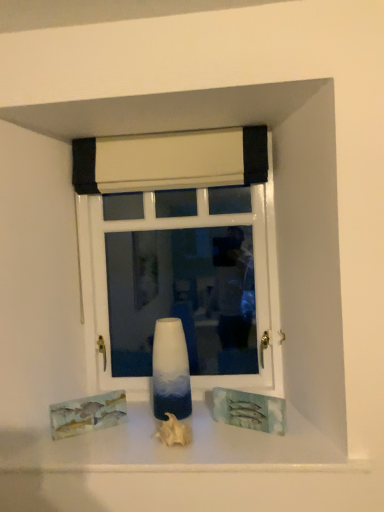
Where is `free point above white fabric curtain at upper center (from a real-world perspective)`? This screenshot has height=512, width=384. free point above white fabric curtain at upper center (from a real-world perspective) is located at coordinates (165, 131).